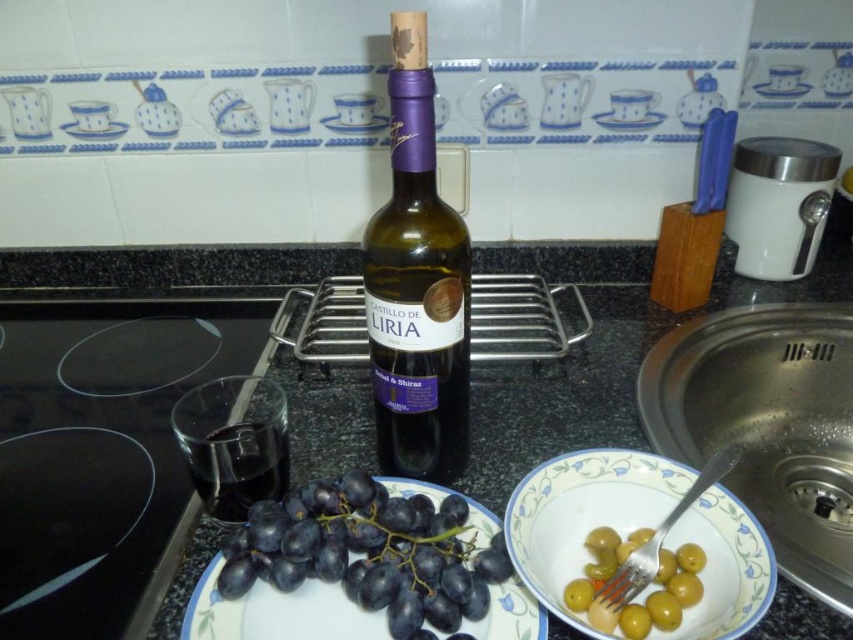
Is white ceramic bowl at lower right to the left of transparent glass at left from the viewer's perspective?

No, white ceramic bowl at lower right is not to the left of transparent glass at left.

Is white ceramic bowl at lower right to the right of transparent glass at left from the viewer's perspective?

Correct, you'll find white ceramic bowl at lower right to the right of transparent glass at left.

Looking at this image, who is more distant from viewer, (672,628) or (206,465)?

Positioned behind is point (206,465).

Where is `white ceramic bowl at lower right`? This screenshot has width=853, height=640. white ceramic bowl at lower right is located at coordinates (583, 515).

Can you confirm if white ceramic plate at upper right is positioned to the right of white ceramic plate at upper center?

Yes, white ceramic plate at upper right is to the right of white ceramic plate at upper center.

Is point (793, 77) farther from viewer compared to point (126, 125)?

That is True.

This screenshot has width=853, height=640. Find the location of `white ceramic plate at upper right`. white ceramic plate at upper right is located at coordinates (781, 88).

Who is taller, purple matte wine bottle at center or shiny dark purple grapes at center-left?

purple matte wine bottle at center is taller.

Does purple matte wine bottle at center have a larger size compared to shiny dark purple grapes at center-left?

Indeed, purple matte wine bottle at center has a larger size compared to shiny dark purple grapes at center-left.

In order to click on purple matte wine bottle at center in this screenshot , I will do `click(416, 284)`.